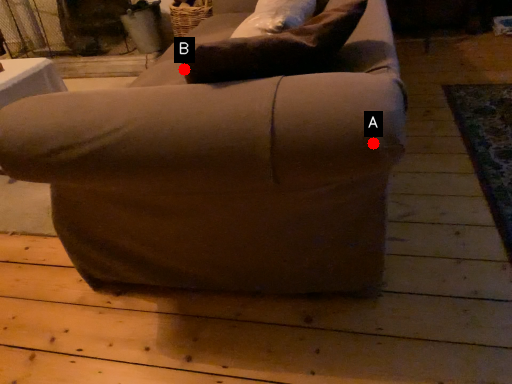
Question: Two points are circled on the image, labeled by A and B beside each circle. Which point is closer to the camera taking this photo?

Choices:
 (A) A is closer
 (B) B is closer

Answer: (A)